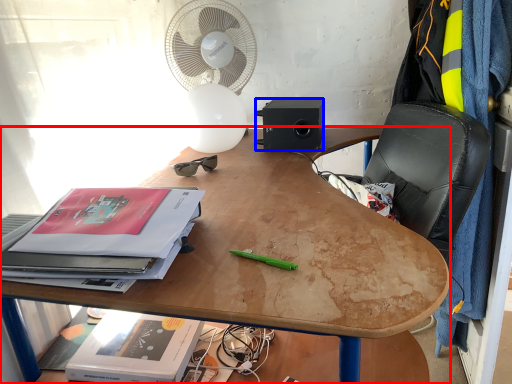
Question: Which object is further to the camera taking this photo, desk (highlighted by a red box) or loudspeaker (highlighted by a blue box)?

Choices:
 (A) desk
 (B) loudspeaker

Answer: (B)